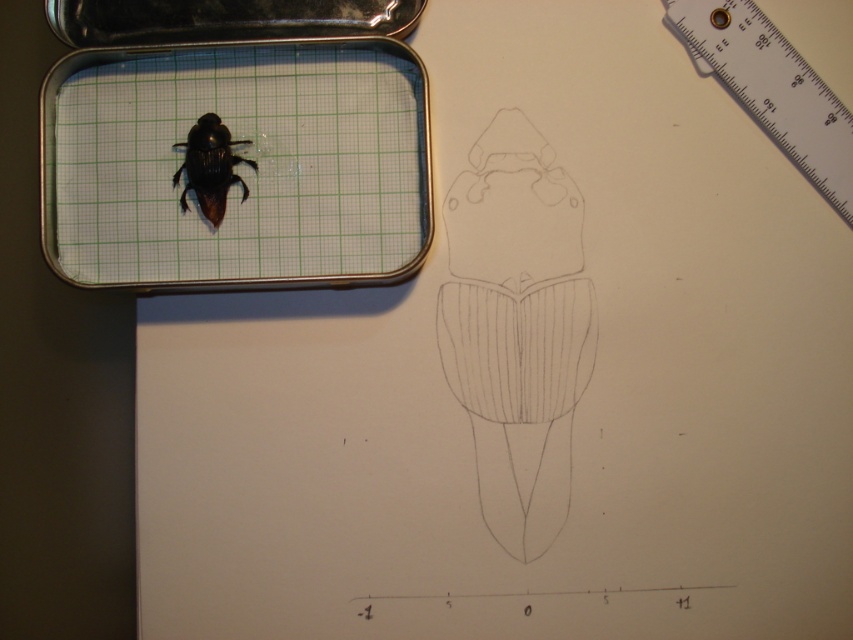
Who is more forward, (x=753, y=12) or (x=225, y=140)?

Point (x=753, y=12) is in front.

Based on the photo, can you confirm if white plastic ruler at upper right is shorter than shiny black beetle at center?

In fact, white plastic ruler at upper right may be taller than shiny black beetle at center.

The image size is (853, 640). In order to click on white plastic ruler at upper right in this screenshot , I will do `click(773, 88)`.